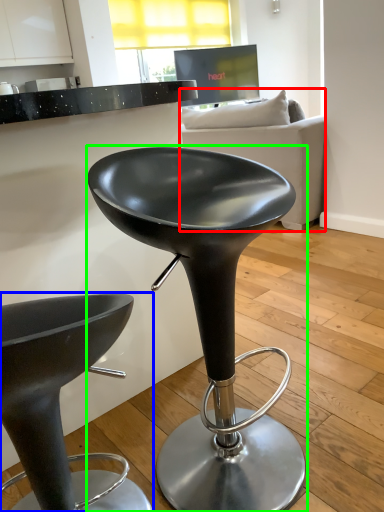
Question: Which object is positioned farthest from studio couch (highlighted by a red box)? Select from stool (highlighted by a blue box) and stool (highlighted by a green box).

Choices:
 (A) stool
 (B) stool

Answer: (A)